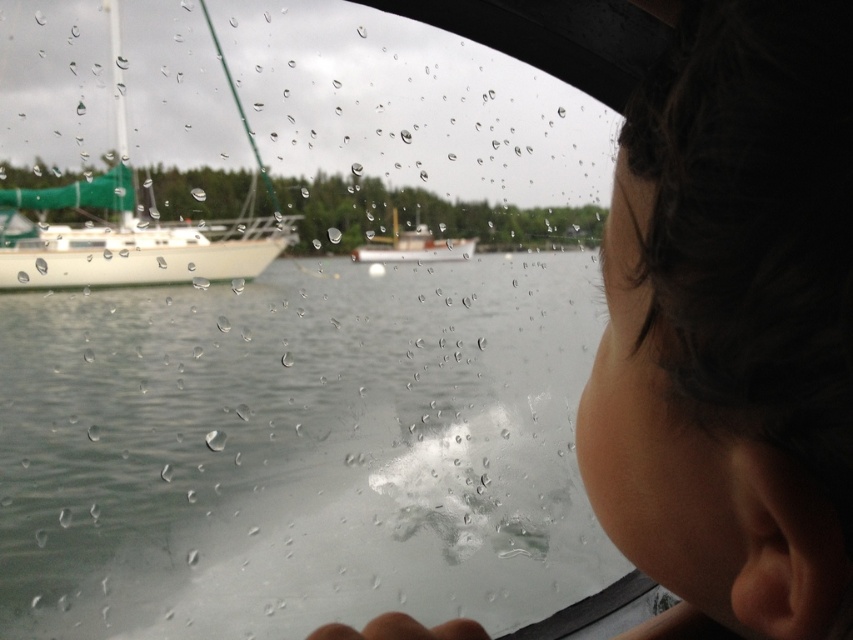
You are a photographer trying to capture a clear shot of the white matte boat at center without any obstructions. Given the dark brown hair at upper right, can you determine if the hair is blocking the view of the boat?

The dark brown hair at upper right is located below the white matte boat at center, so it is not blocking the view of the boat.

You are a delivery drone operator. Your drone has a wingspan of 25 inches. You need to fly the drone through the gap between the white matte sailboat at left and the white matte boat at center. Can the drone safely pass through this gap without touching either boat?

The gap between the white matte sailboat at left and the white matte boat at center is 27.49 inches. Since the drone has a wingspan of 25 inches, which is smaller than the gap, the drone can safely pass through without touching either boat.